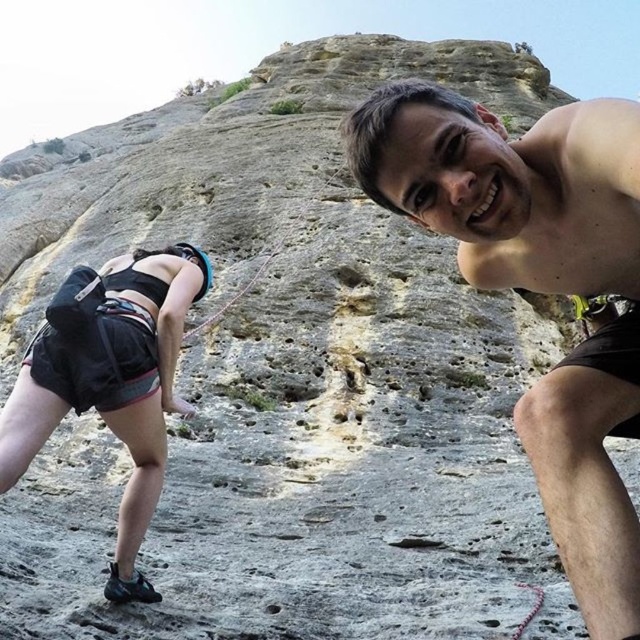
Can you confirm if shiny black shorts at center is positioned below rope at center?

Indeed, shiny black shorts at center is positioned under rope at center.

Describe the element at coordinates (538, 289) in the screenshot. This screenshot has height=640, width=640. I see `shiny black shorts at center` at that location.

What are the coordinates of `shiny black shorts at center` in the screenshot? It's located at (538, 289).

Looking at this image, can you confirm if shiny black shorts at center is smaller than black fabric shorts at lower left?

Yes.

Is shiny black shorts at center taller than black fabric shorts at lower left?

Indeed, shiny black shorts at center has a greater height compared to black fabric shorts at lower left.

Locate an element on the screen. shiny black shorts at center is located at coordinates (538, 289).

Who is shorter, black fabric shorts at lower left or rope at center?

rope at center

Is black fabric shorts at lower left thinner than rope at center?

In fact, black fabric shorts at lower left might be wider than rope at center.

I want to click on black fabric shorts at lower left, so click(x=109, y=380).